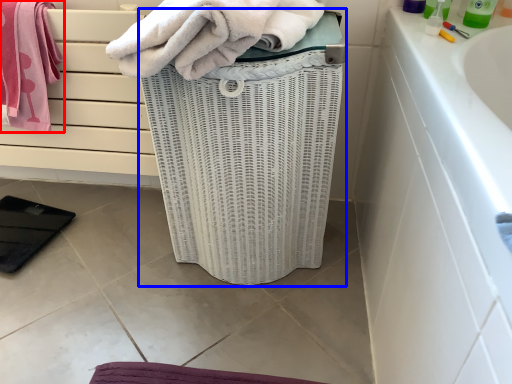
Question: Which object appears closest to the camera in this image, towel (highlighted by a red box) or basket container (highlighted by a blue box)?

Choices:
 (A) towel
 (B) basket container

Answer: (B)